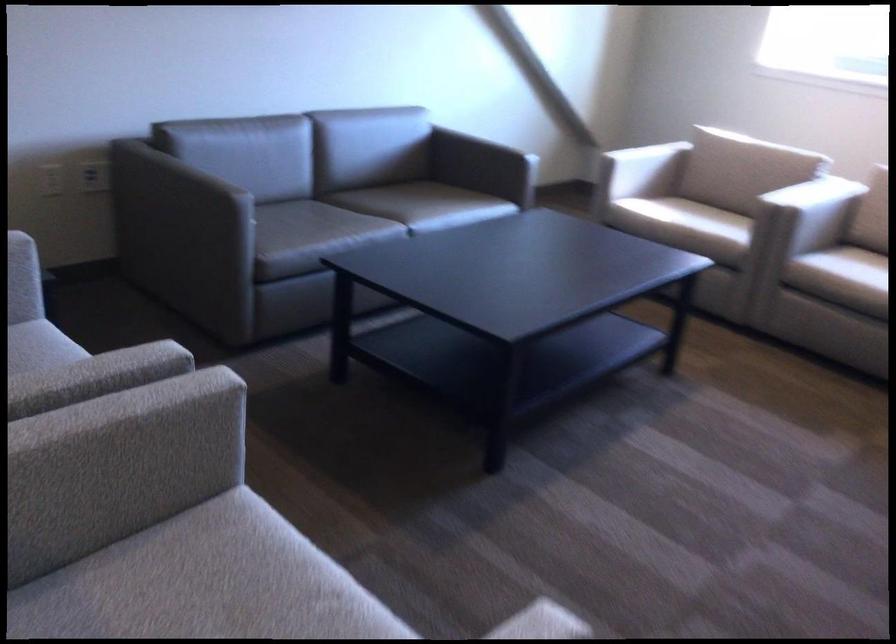
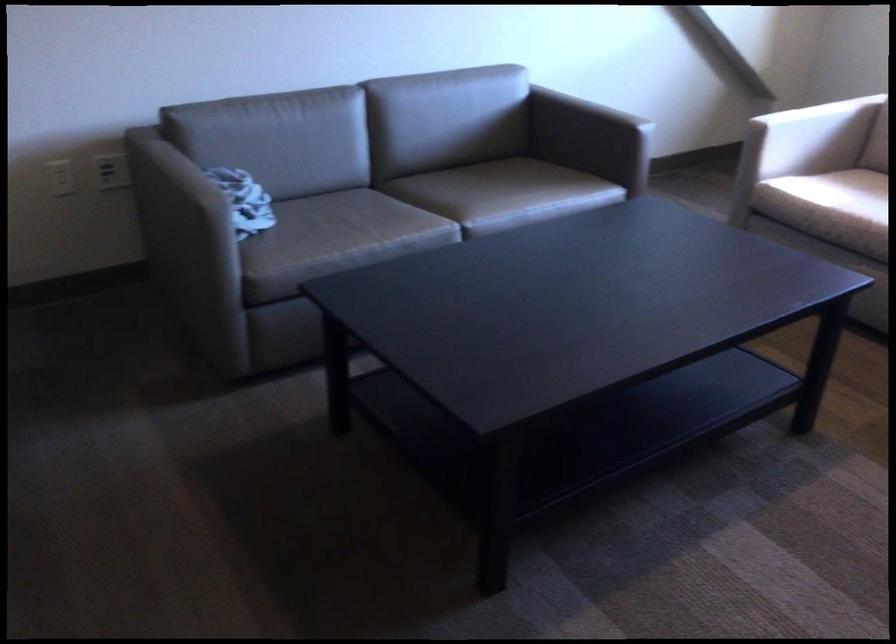
Where in the second image is the point corresponding to [478,135] from the first image?

(605, 93)